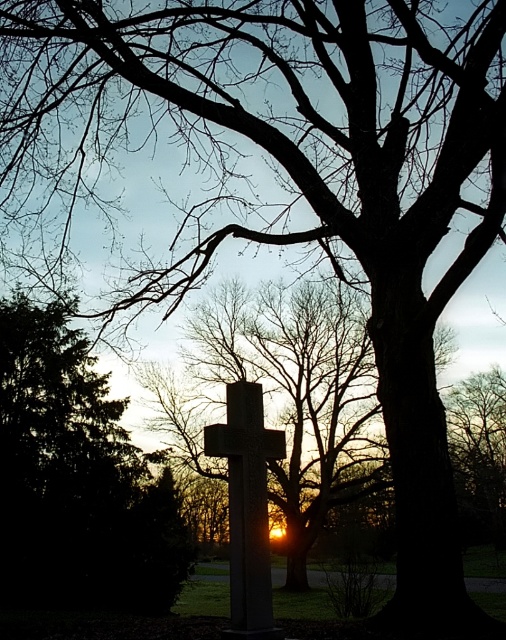
You are a photographer trying to capture the smooth stone cross at center against the sunset backdrop. However, the green leafy tree at left is blocking part of the view. Can you adjust your position to ensure the cross remains centered while avoiding the tree?

The green leafy tree at left is positioned under the smooth stone cross at center, so moving to the right side would allow the cross to stay centered while avoiding the tree.

You are an artist trying to paint this scene. You need to decide whether the green leafy tree at left will block the view of the smooth stone cross at center from your current position. Can you determine this based on their widths?

The green leafy tree at left might be wider than smooth stone cross at center, so there is a possibility that the tree could partially block the cross depending on their exact positions and angles.

You are standing in the scene and want to walk towards the green leafy tree at left. Based on its position, in which general direction should you head from your current position at the center of the image?

The green leafy tree at left is located at point (76,480), which means it is positioned to the left and slightly forward relative to the center. You should head towards the left and slightly forward direction to reach it.